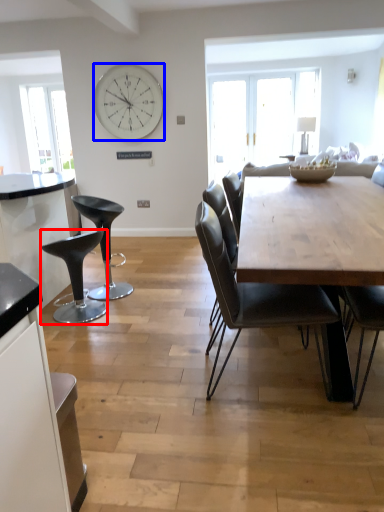
Question: Among these objects, which one is farthest to the camera, stool (highlighted by a red box) or wall clock (highlighted by a blue box)?

Choices:
 (A) stool
 (B) wall clock

Answer: (B)